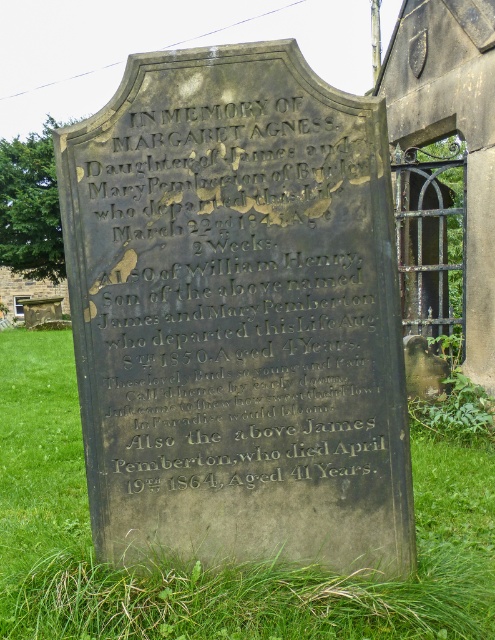
Based on the photo, can you confirm if black stone inscription at center is positioned to the left of green grass at lower center?

In fact, black stone inscription at center is to the right of green grass at lower center.

Between black stone inscription at center and green grass at lower center, which one has less height?

green grass at lower center

Is point (109, 416) behind point (9, 474)?

No, (109, 416) is in front of (9, 474).

Find the location of a particular element. Image resolution: width=495 pixels, height=640 pixels. black stone inscription at center is located at coordinates (238, 291).